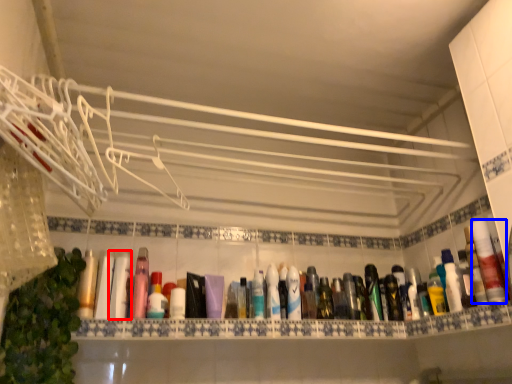
Question: Which of the following is the closest to the observer, mouthwash (highlighted by a red box) or mouthwash (highlighted by a blue box)?

Choices:
 (A) mouthwash
 (B) mouthwash

Answer: (B)